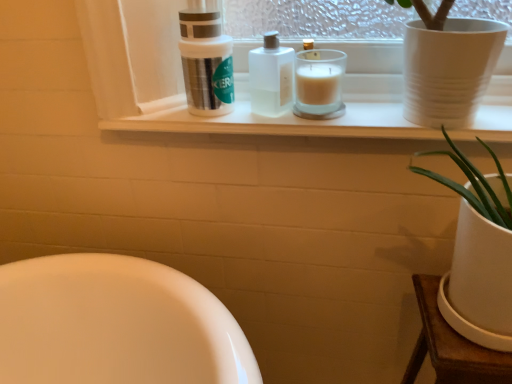
Question: From the image's perspective, is translucent glass candle at center over white matte window sill at upper center?

Choices:
 (A) yes
 (B) no

Answer: (A)

Question: Does translucent glass candle at center lie behind white matte window sill at upper center?

Choices:
 (A) yes
 (B) no

Answer: (A)

Question: From a real-world perspective, is translucent glass candle at center physically below white matte window sill at upper center?

Choices:
 (A) yes
 (B) no

Answer: (B)

Question: From a real-world perspective, is translucent glass candle at center over white matte window sill at upper center?

Choices:
 (A) no
 (B) yes

Answer: (B)

Question: Is translucent glass candle at center smaller than white matte window sill at upper center?

Choices:
 (A) no
 (B) yes

Answer: (B)

Question: Would you say silver metallic container at upper center is inside or outside clear plastic bottle at center?

Choices:
 (A) inside
 (B) outside

Answer: (B)

Question: Considering the positions of point (187, 102) and point (264, 76), is point (187, 102) closer or farther from the camera than point (264, 76)?

Choices:
 (A) farther
 (B) closer

Answer: (A)

Question: From the image's perspective, relative to clear plastic bottle at center, is silver metallic container at upper center above or below?

Choices:
 (A) below
 (B) above

Answer: (B)

Question: Is silver metallic container at upper center wider or thinner than clear plastic bottle at center?

Choices:
 (A) wide
 (B) thin

Answer: (A)

Question: Visually, is silver metallic container at upper center positioned to the left or to the right of translucent glass candle at center?

Choices:
 (A) right
 (B) left

Answer: (B)

Question: From the image's perspective, is silver metallic container at upper center located above or below translucent glass candle at center?

Choices:
 (A) below
 (B) above

Answer: (B)

Question: Is silver metallic container at upper center wider or thinner than translucent glass candle at center?

Choices:
 (A) wide
 (B) thin

Answer: (A)

Question: In terms of height, does silver metallic container at upper center look taller or shorter compared to translucent glass candle at center?

Choices:
 (A) tall
 (B) short

Answer: (A)

Question: Considering the positions of clear plastic bottle at center and silver metallic container at upper center in the image, is clear plastic bottle at center wider or thinner than silver metallic container at upper center?

Choices:
 (A) thin
 (B) wide

Answer: (A)

Question: From a real-world perspective, relative to silver metallic container at upper center, is clear plastic bottle at center vertically above or below?

Choices:
 (A) below
 (B) above

Answer: (A)